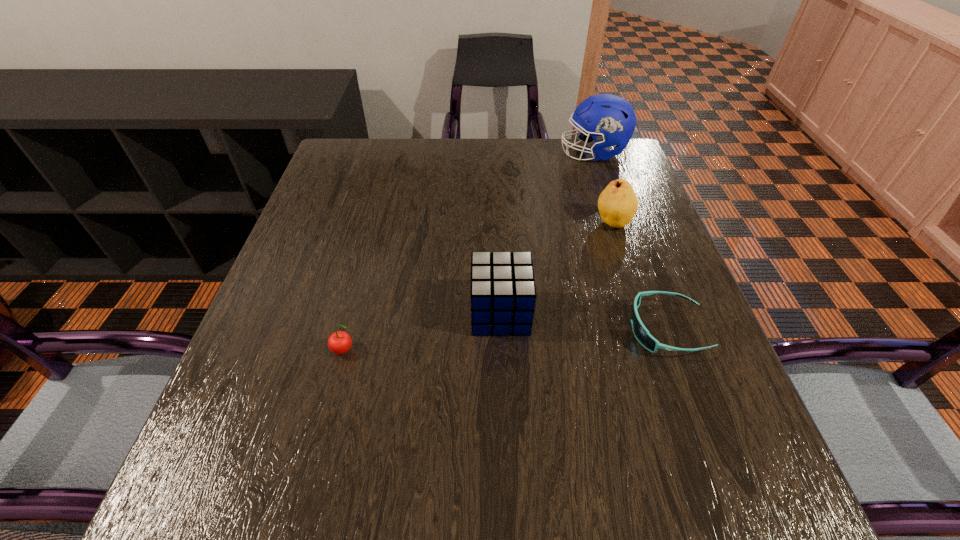
What are the coordinates of `sunglasses that is positioned at the right edge` in the screenshot? It's located at (641, 333).

Where is `object situated at the far right corner`? The image size is (960, 540). object situated at the far right corner is located at coordinates (611, 120).

In the image, there is a desktop. At what (x,y) coordinates should I click in order to perform the action: click on vacant space at the far edge. Please return your answer as a coordinate pair (x, y). The image size is (960, 540). Looking at the image, I should click on (419, 144).

The height and width of the screenshot is (540, 960). What are the coordinates of `vacant area at the near edge` in the screenshot? It's located at (335, 489).

The height and width of the screenshot is (540, 960). Find the location of `vacant space at the left edge of the desktop`. vacant space at the left edge of the desktop is located at coordinates (365, 197).

Find the location of a particular element. The image size is (960, 540). free space at the right edge is located at coordinates (661, 410).

Locate an element on the screen. The image size is (960, 540). vacant space at the far left corner is located at coordinates (346, 148).

Find the location of `vacant space that is in between the second object from left to right and the pear`. vacant space that is in between the second object from left to right and the pear is located at coordinates (557, 268).

In order to click on empty space between the cherry and the football helmet in this screenshot , I will do `click(469, 252)`.

This screenshot has height=540, width=960. I want to click on free area in between the second object from left to right and the leftmost object, so click(422, 332).